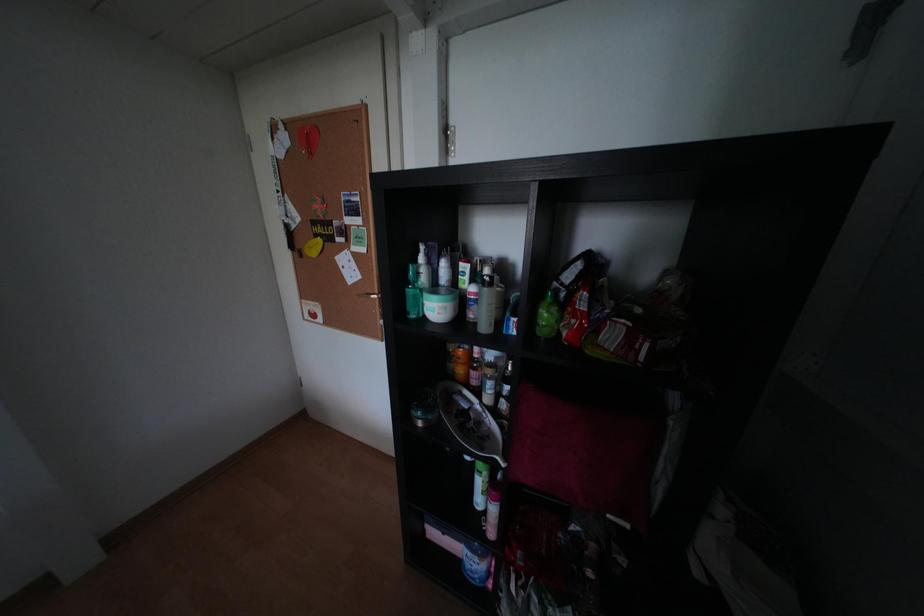
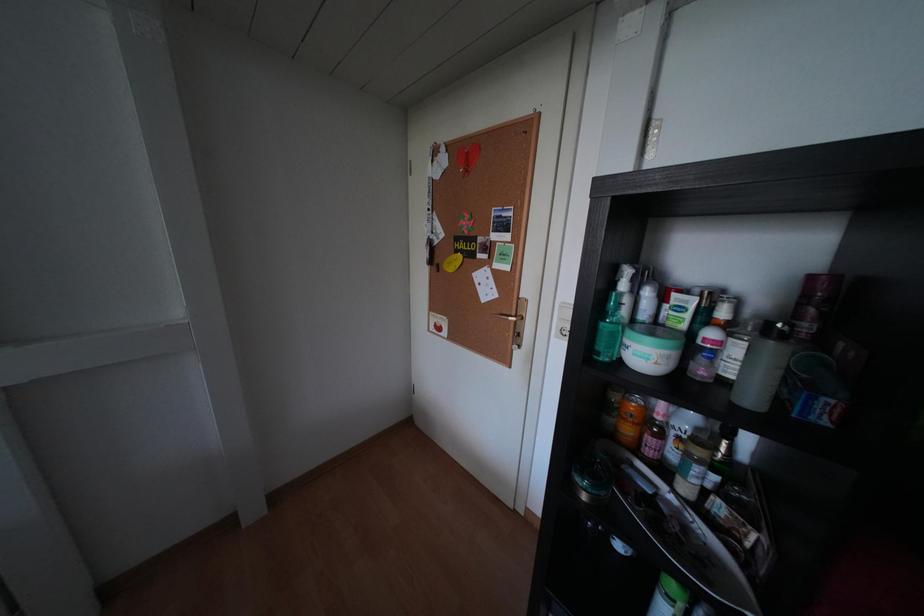
Question: In a continuous first-person perspective shot, in which direction is the camera moving?

Choices:
 (A) Left
 (B) Right
 (C) Forward
 (D) Backward

Answer: (A)